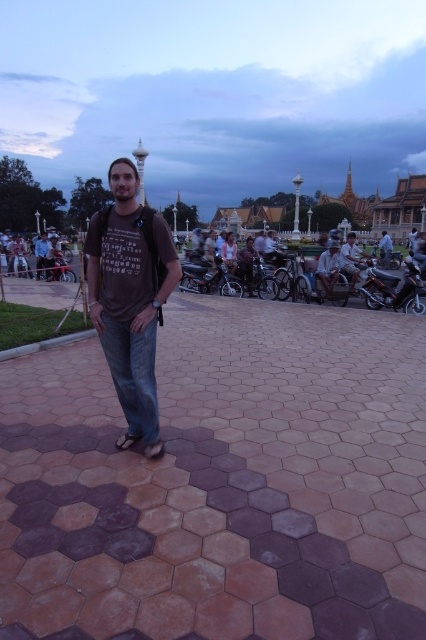
You are trying to park your car between the shiny metallic motorcycle at right and the metallic silver motorcycle at left. Can you fit your car there if your car is 2 meters wide?

The shiny metallic motorcycle at right has a lesser width compared to metallic silver motorcycle at left. The total width between them is not provided, so it is impossible to determine if the car can fit.

You are standing on the hexagonal pavement with alternating brown and dark reddish tiles. You see a metallic silver motorcycle at center. Where is the metallic silver motorcycle located in relation to your current position?

The metallic silver motorcycle at center is located at coordinates point (209, 278) relative to your position.

You are a delivery person who needs to park your metallic silver motorcycle at center and your light brown leather jacket at right. Which item requires more space to store?

The light brown leather jacket at right requires more space to store because the metallic silver motorcycle at center occupies less space than it.